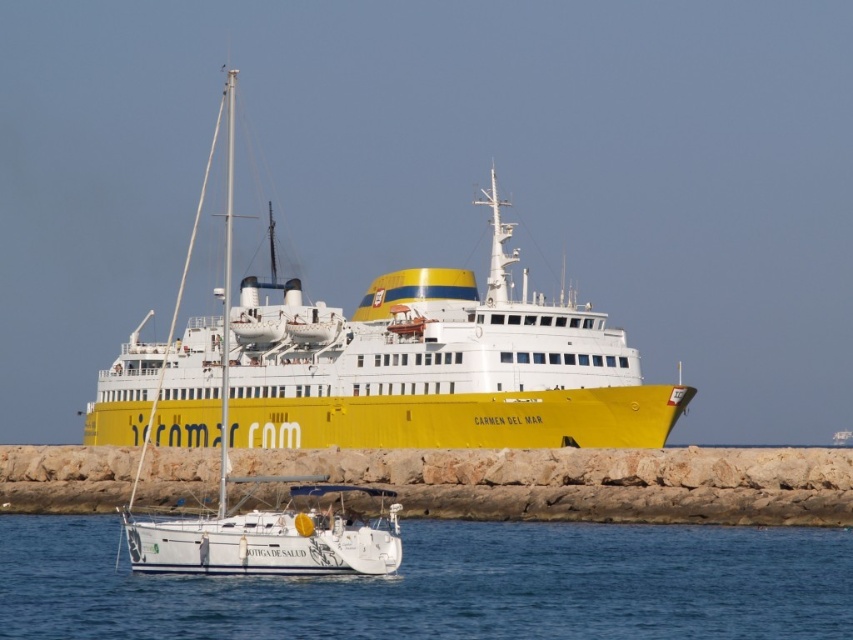
You are standing on the dock and looking at the yellow matte ship at center and the transparent blue water at lower center. Which object is closer to your eye level?

The yellow matte ship at center is closer to your eye level because it is above the transparent blue water at lower center.

Looking at this image, you are standing on the dock and see the yellow matte ship at center and the transparent blue water at lower center. Which object is closer to your right side?

The transparent blue water at lower center is closer to your right side because the yellow matte ship at center is to the left of it.